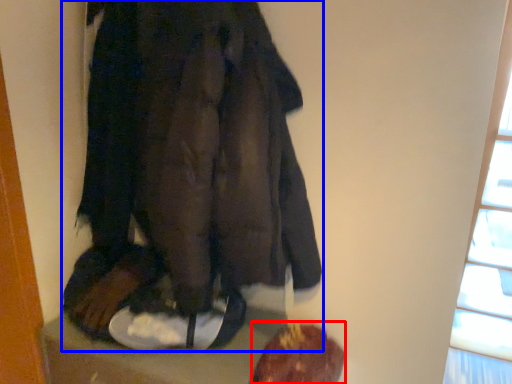
Question: Among these objects, which one is farthest to the camera, food (highlighted by a red box) or fancy dress (highlighted by a blue box)?

Choices:
 (A) food
 (B) fancy dress

Answer: (A)